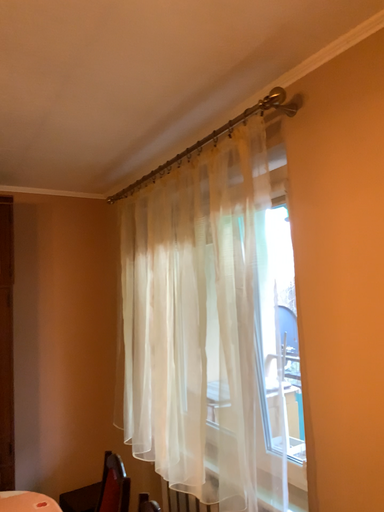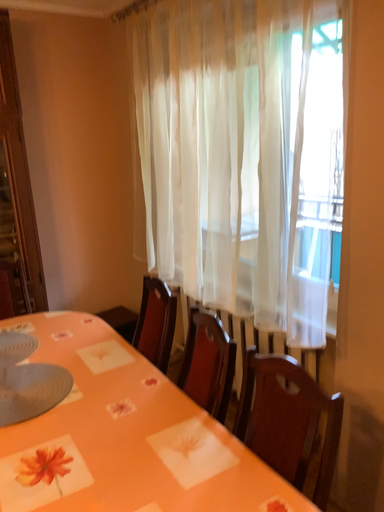
Question: How did the camera likely rotate when shooting the video?

Choices:
 (A) rotated upward
 (B) rotated downward

Answer: (B)